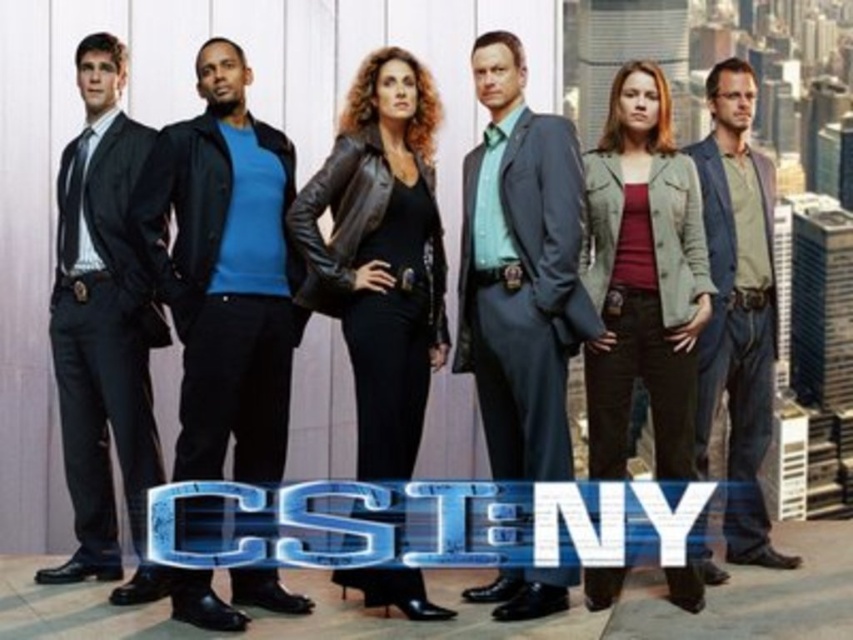
Is matte gray suit at center below black leather jacket at center?

Incorrect, matte gray suit at center is not positioned below black leather jacket at center.

Is the position of matte gray suit at center more distant than that of black leather jacket at center?

No, matte gray suit at center is closer to the viewer.

Is point (498, 220) more distant than point (428, 257)?

No, (498, 220) is closer to viewer.

This screenshot has height=640, width=853. Identify the location of matte gray suit at center. (521, 269).

Which is in front, point (532, 124) or point (656, 269)?

Point (656, 269)

Which of these two, matte gray suit at center or green textured jacket at center, stands shorter?

green textured jacket at center

Who is more forward, (520,164) or (706,259)?

Point (706,259) is in front.

Image resolution: width=853 pixels, height=640 pixels. I want to click on matte gray suit at center, so click(521, 269).

Is matte gray suit at center taller than denim jacket at right?

Yes.

Is matte gray suit at center wider than denim jacket at right?

Yes, matte gray suit at center is wider than denim jacket at right.

Which is behind, point (517, 220) or point (701, 156)?

Positioned behind is point (517, 220).

At what (x,y) coordinates should I click in order to perform the action: click on matte gray suit at center. Please return your answer as a coordinate pair (x, y). The image size is (853, 640). Looking at the image, I should click on (521, 269).